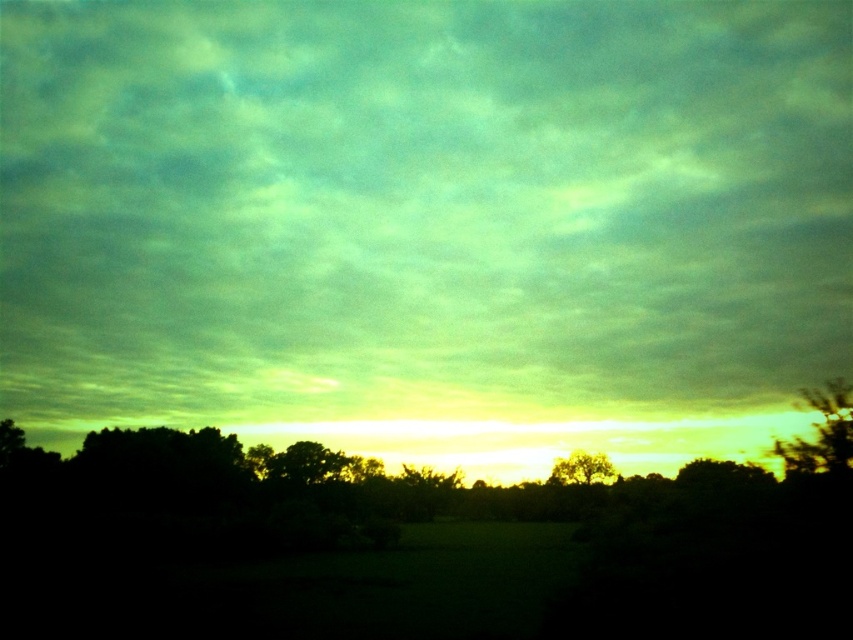
You are an artist painting this landscape and want to ensure proper layering for depth. Which tree should you paint first, the silvery metallic tree at right or the golden textured tree at center?

The silvery metallic tree at right should be painted first because it is in front of the golden textured tree at center, allowing the latter to be layered behind it for depth.